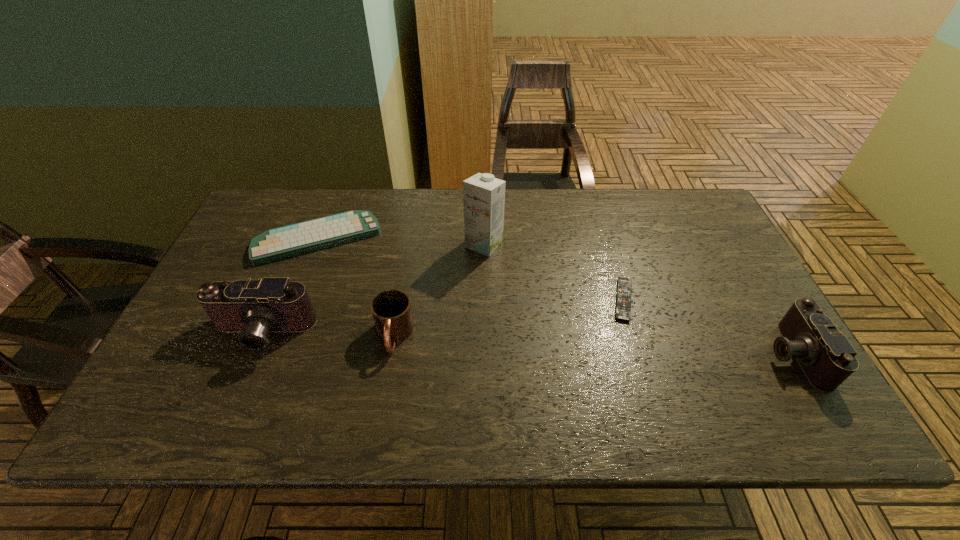
You are a GUI agent. You are given a task and a screenshot of the screen. Output one action in this format:
    pyautogui.click(x=<x>, y=<y>)
    Task: Click on the vacant space located on the front-facing side of the taller camera
    Image resolution: width=960 pixels, height=540 pixels.
    Given the screenshot: What is the action you would take?
    pyautogui.click(x=238, y=389)

At what (x,y) coordinates should I click in order to perform the action: click on free space located 0.270m on the front-facing side of the shorter camera. Please return your answer as a coordinate pair (x, y). The width and height of the screenshot is (960, 540). Looking at the image, I should click on (653, 354).

I want to click on vacant point located 0.270m on the front-facing side of the shorter camera, so click(x=653, y=354).

The image size is (960, 540). Identify the location of vacant region located on the front-facing side of the shorter camera. 704,354.

Locate an element on the screen. The width and height of the screenshot is (960, 540). free space located on the back of the shortest object is located at coordinates (598, 215).

Where is `free space located on the left of the tallest object`? free space located on the left of the tallest object is located at coordinates (431, 244).

The height and width of the screenshot is (540, 960). I want to click on free space located on the right of the second shortest object, so click(433, 239).

Find the location of a particular element. The width and height of the screenshot is (960, 540). carton that is at the far edge is located at coordinates (483, 195).

Image resolution: width=960 pixels, height=540 pixels. Find the location of `computer keyboard situated at the far edge`. computer keyboard situated at the far edge is located at coordinates (287, 241).

Find the location of a particular element. The height and width of the screenshot is (540, 960). mug at the near edge is located at coordinates (391, 309).